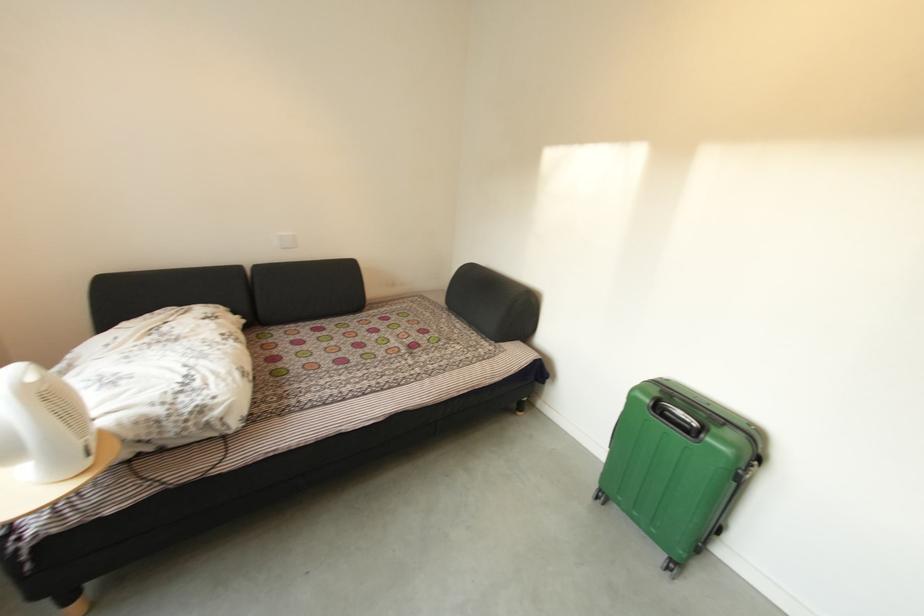
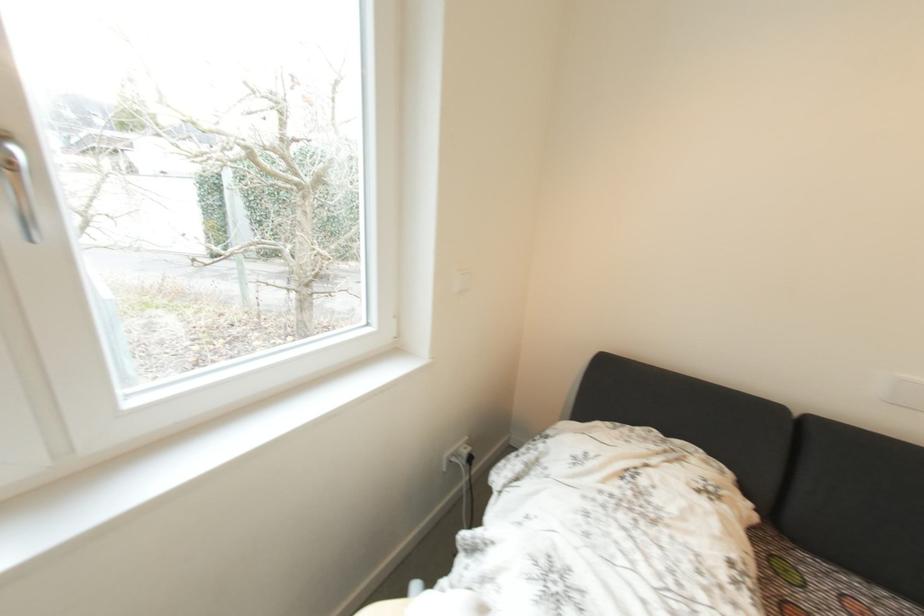
Question: The camera is either moving clockwise (left) or counter-clockwise (right) around the object. The first image is from the beginning of the video and the second image is from the end. Is the camera moving left or right when shooting the video?

Choices:
 (A) Left
 (B) Right

Answer: (B)